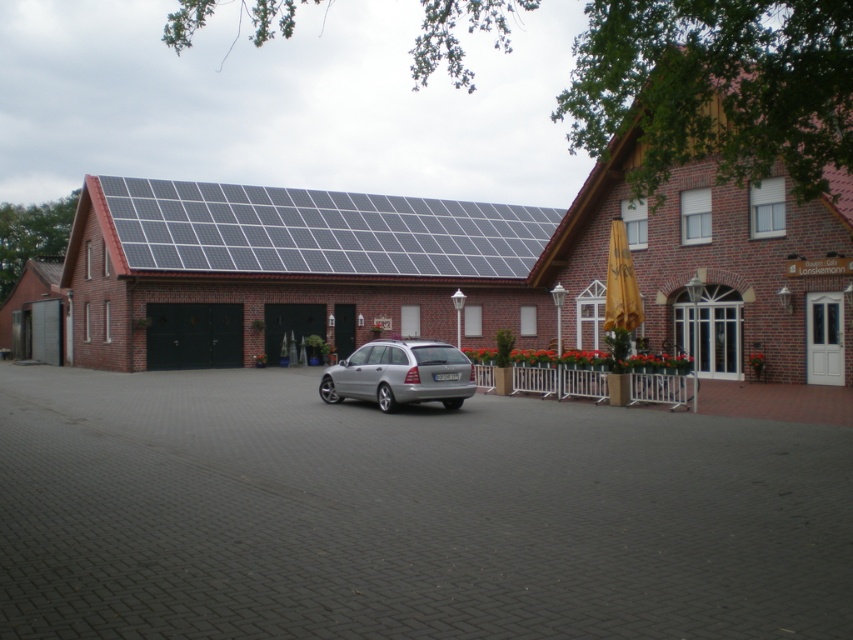
Question: Among these objects, which one is nearest to the camera?

Choices:
 (A) black solar panels at upper center
 (B) brown shingles at upper right
 (C) silver metallic station wagon at center

Answer: (B)

Question: Is brown shingles at upper right to the right of silver metallic station wagon at center from the viewer's perspective?

Choices:
 (A) no
 (B) yes

Answer: (B)

Question: Is the position of black solar panels at upper center more distant than that of silver metallic station wagon at center?

Choices:
 (A) yes
 (B) no

Answer: (A)

Question: Is brown shingles at upper right bigger than silver metallic station wagon at center?

Choices:
 (A) yes
 (B) no

Answer: (A)

Question: Which of the following is the farthest from the observer?

Choices:
 (A) (347, 250)
 (B) (403, 349)
 (C) (596, 160)

Answer: (A)

Question: Which point is closer to the camera taking this photo?

Choices:
 (A) (310, 237)
 (B) (782, 148)
 (C) (634, 556)

Answer: (C)